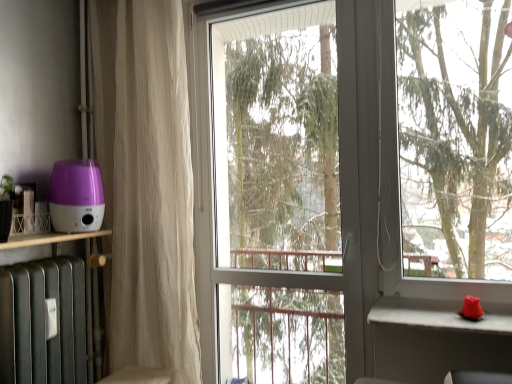
Question: Is purple plastic humidifier at left at the right side of white sheer curtain at left?

Choices:
 (A) no
 (B) yes

Answer: (A)

Question: From a real-world perspective, is purple plastic humidifier at left located beneath white sheer curtain at left?

Choices:
 (A) no
 (B) yes

Answer: (B)

Question: Considering the relative sizes of purple plastic humidifier at left and white sheer curtain at left in the image provided, is purple plastic humidifier at left smaller than white sheer curtain at left?

Choices:
 (A) no
 (B) yes

Answer: (B)

Question: Is white sheer curtain at left surrounded by purple plastic humidifier at left?

Choices:
 (A) yes
 (B) no

Answer: (B)

Question: Considering the relative sizes of purple plastic humidifier at left and white sheer curtain at left in the image provided, is purple plastic humidifier at left thinner than white sheer curtain at left?

Choices:
 (A) no
 (B) yes

Answer: (A)

Question: From a real-world perspective, is transparent glass screen door at center positioned above or below white concrete window sill at right?

Choices:
 (A) below
 (B) above

Answer: (B)

Question: In terms of height, does transparent glass screen door at center look taller or shorter compared to white concrete window sill at right?

Choices:
 (A) tall
 (B) short

Answer: (A)

Question: Would you say transparent glass screen door at center is to the left or to the right of white concrete window sill at right in the picture?

Choices:
 (A) right
 (B) left

Answer: (B)

Question: Considering the positions of transparent glass screen door at center and white concrete window sill at right in the image, is transparent glass screen door at center wider or thinner than white concrete window sill at right?

Choices:
 (A) thin
 (B) wide

Answer: (A)

Question: From a real-world perspective, relative to white sheer curtain at left, is transparent glass screen door at center vertically above or below?

Choices:
 (A) above
 (B) below

Answer: (B)

Question: Is transparent glass screen door at center wider or thinner than white sheer curtain at left?

Choices:
 (A) wide
 (B) thin

Answer: (B)

Question: Is point (205, 9) closer or farther from the camera than point (122, 236)?

Choices:
 (A) farther
 (B) closer

Answer: (A)

Question: Considering their positions, is transparent glass screen door at center located in front of or behind white sheer curtain at left?

Choices:
 (A) behind
 (B) front

Answer: (B)

Question: Based on their sizes in the image, would you say white sheer curtain at left is bigger or smaller than purple plastic humidifier at left?

Choices:
 (A) small
 (B) big

Answer: (B)

Question: Which is correct: white sheer curtain at left is inside purple plastic humidifier at left, or outside of it?

Choices:
 (A) inside
 (B) outside

Answer: (B)